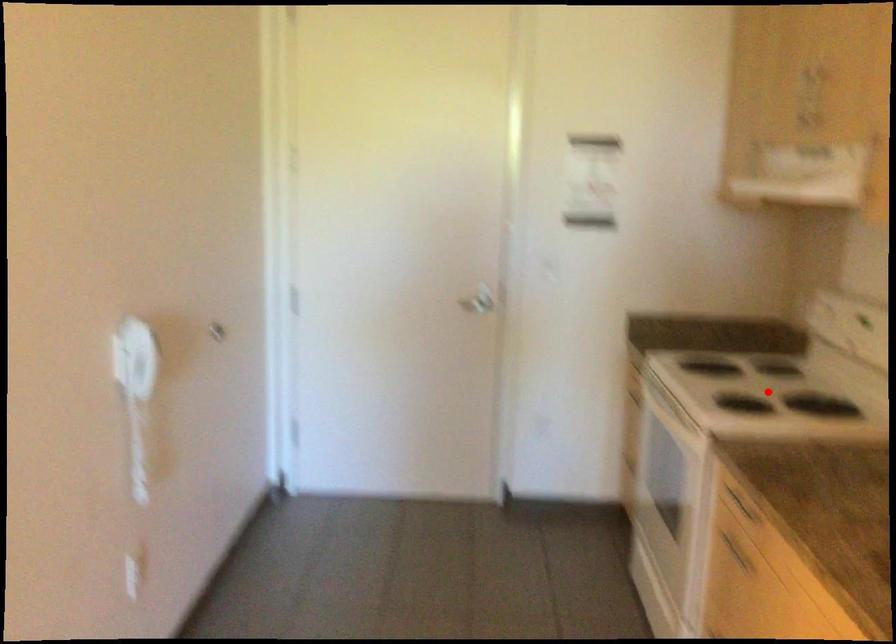
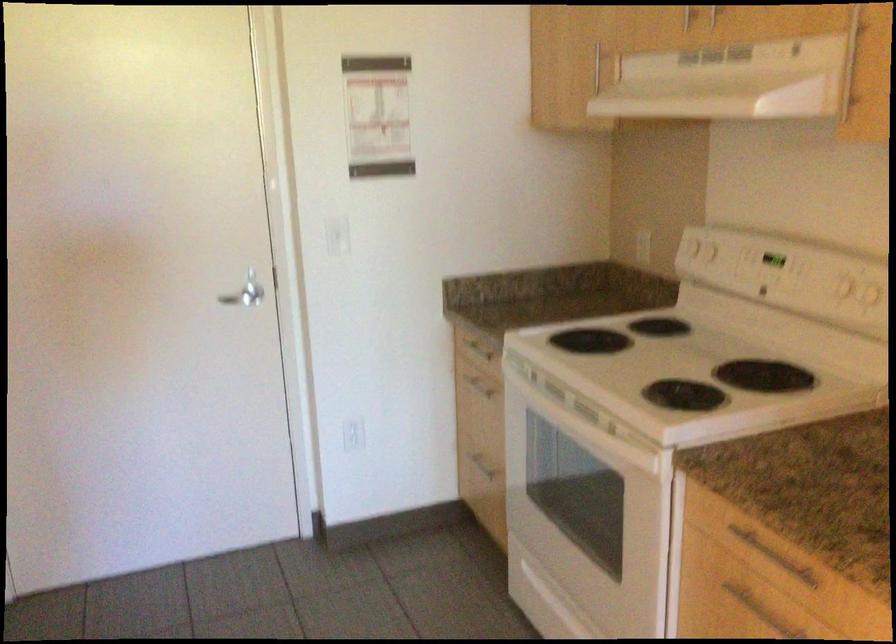
In the second image, find the point that corresponds to the highlighted location in the first image.

(686, 365)